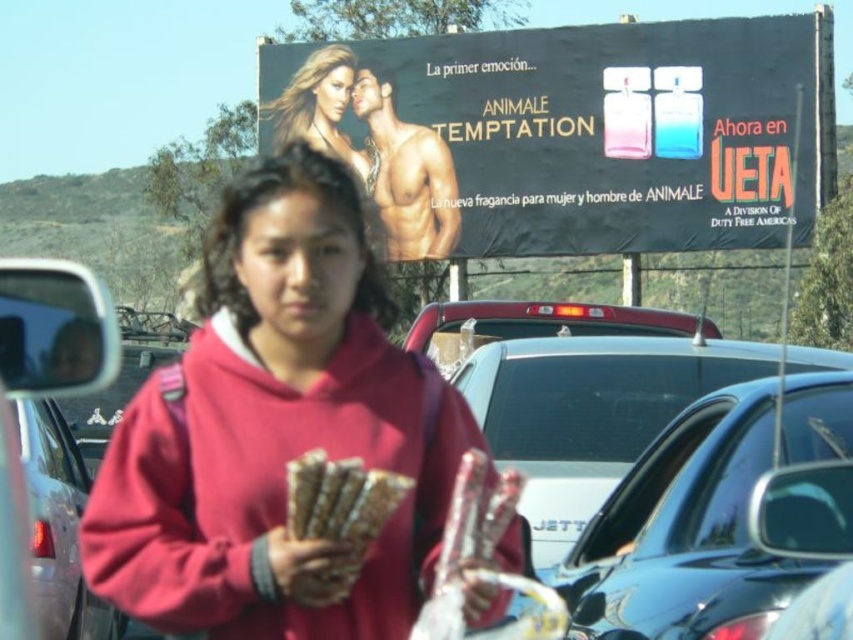
You are a photographer trying to capture a clear shot of the billboard advertisement. You notice two cars, a metallic silver sedan at center and a matte red car at center, blocking part of the billboard. Which car should you move to get a better view of the advertisement?

The metallic silver sedan at center is taller than the matte red car at center, so moving the metallic silver sedan at center would provide a better view of the advertisement since it is the taller vehicle obstructing the billboard.

You are a photographer trying to capture the billboard in the background. You notice two points on the billboard at coordinates point [80,584] and point [50,589]. Which point is closer to the camera?

Point [80,584] is further to the camera than point [50,589], so point [50,589] is closer to the camera.

You need to park your car behind the matte red car at center. Can you do that without blocking the metallic silver sedan at center?

The metallic silver sedan at center is in front of the matte red car at center, so the matte red car at center is behind the metallic silver sedan at center. Therefore, parking behind the matte red car at center would require moving past the metallic silver sedan at center, which might not be possible without blocking it.